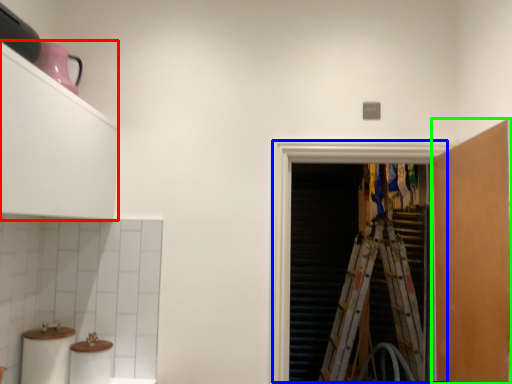
Question: Estimate the real-world distances between objects in this image. Which object is farther from cabinetry (highlighted by a red box), screen door (highlighted by a blue box) or cabinetry (highlighted by a green box)?

Choices:
 (A) screen door
 (B) cabinetry

Answer: (B)